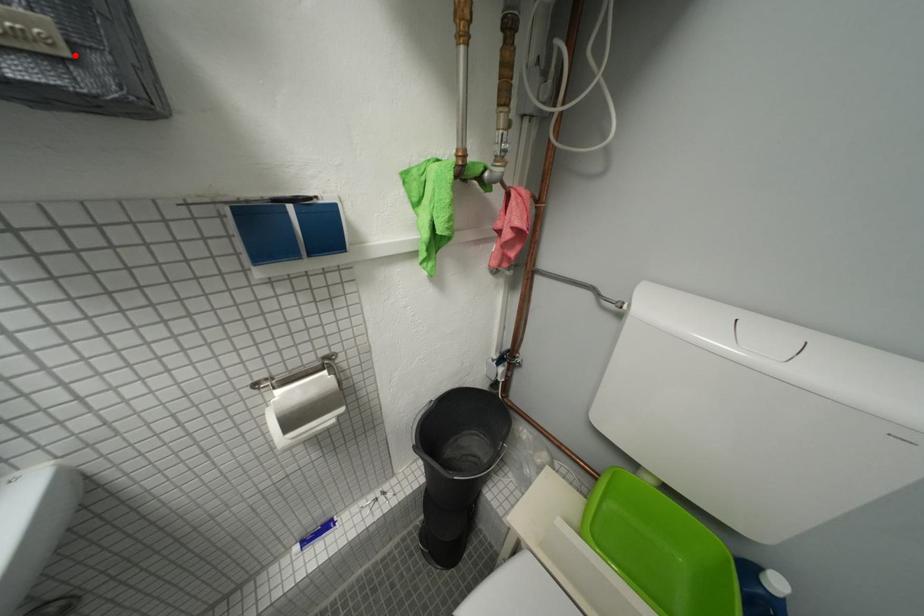
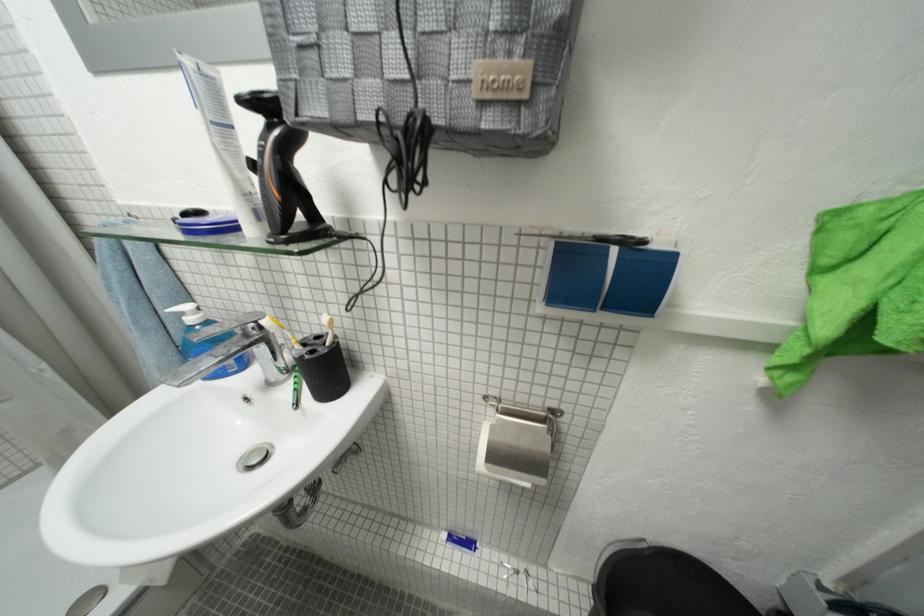
Find the pixel in the second image that matches the highlighted location in the first image.

(535, 98)